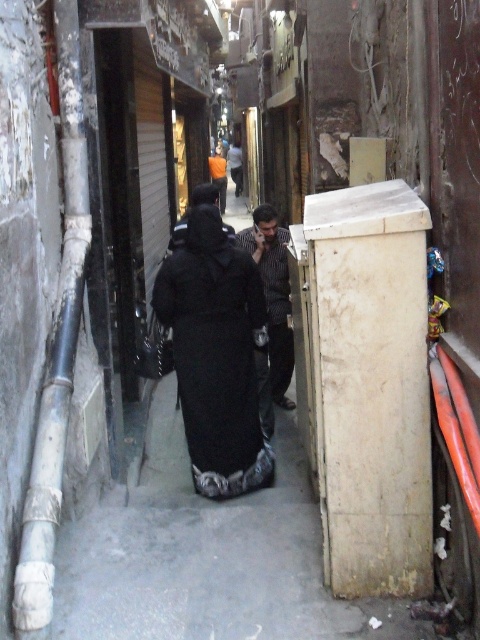
Who is taller, black matte dress at center or striped shirt at center?

black matte dress at center

Can you confirm if black matte dress at center is shorter than striped shirt at center?

No, black matte dress at center is not shorter than striped shirt at center.

Who is more distant from viewer, (272, 458) or (269, 237)?

Positioned behind is point (269, 237).

The image size is (480, 640). I want to click on black matte dress at center, so click(x=216, y=355).